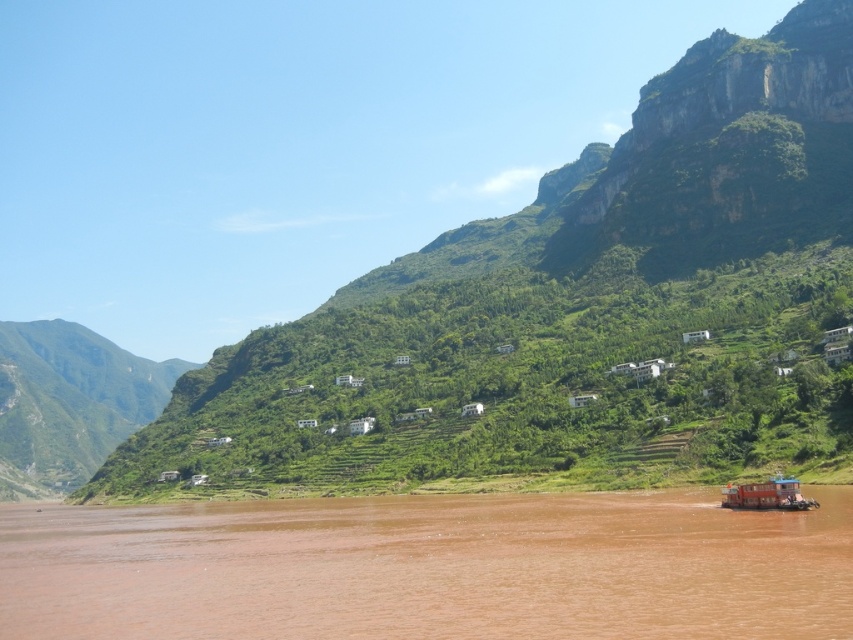
Who is higher up, green grassy hillside at left or orange plastic boat at lower right?

orange plastic boat at lower right

Which is in front, point (167, 400) or point (764, 481)?

Positioned in front is point (764, 481).

Locate an element on the screen. The image size is (853, 640). green grassy hillside at left is located at coordinates click(x=68, y=403).

In the scene shown: Who is shorter, brown muddy water at lower right or orange plastic boat at lower right?

With less height is orange plastic boat at lower right.

Is point (778, 632) positioned behind point (757, 499)?

No, (778, 632) is closer to viewer.

What are the coordinates of `brown muddy water at lower right` in the screenshot? It's located at (428, 566).

Who is lower down, brown muddy water at lower right or green grassy hillside at left?

green grassy hillside at left is below.

Between brown muddy water at lower right and green grassy hillside at left, which one has less height?

With less height is brown muddy water at lower right.

Find the location of a particular element. This screenshot has height=640, width=853. brown muddy water at lower right is located at coordinates (428, 566).